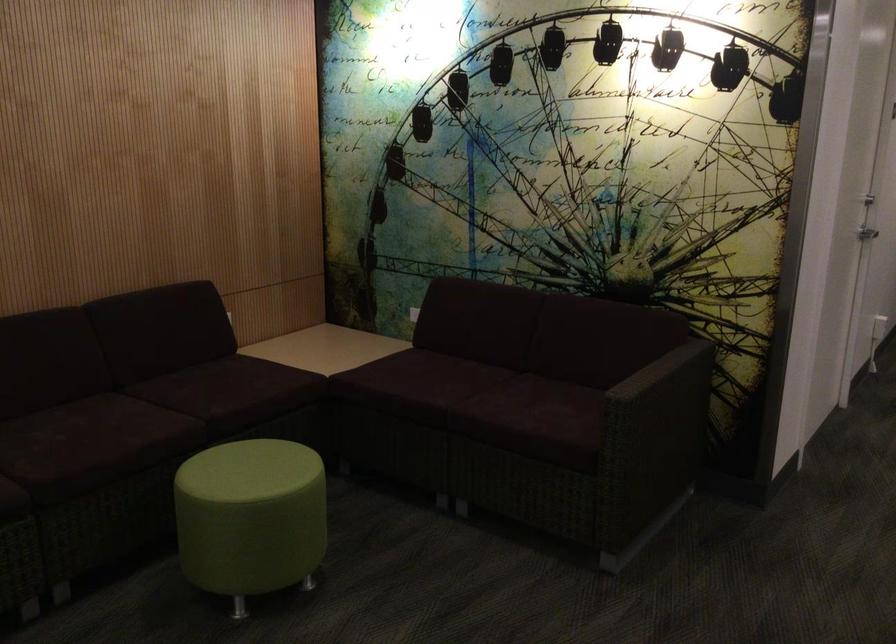
Find where to sit the green stool. Please return your answer as a coordinate pair (x, y).

(251, 518)